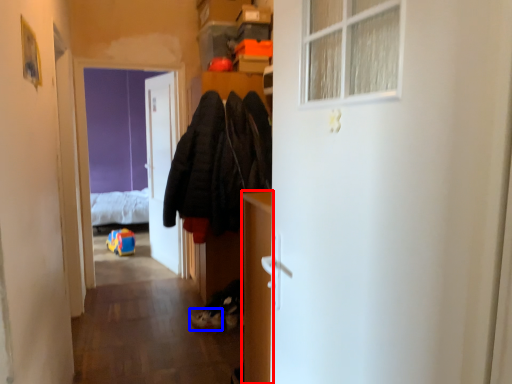
Question: Which object is closer to the camera taking this photo, cabinetry (highlighted by a red box) or shoe (highlighted by a blue box)?

Choices:
 (A) cabinetry
 (B) shoe

Answer: (A)